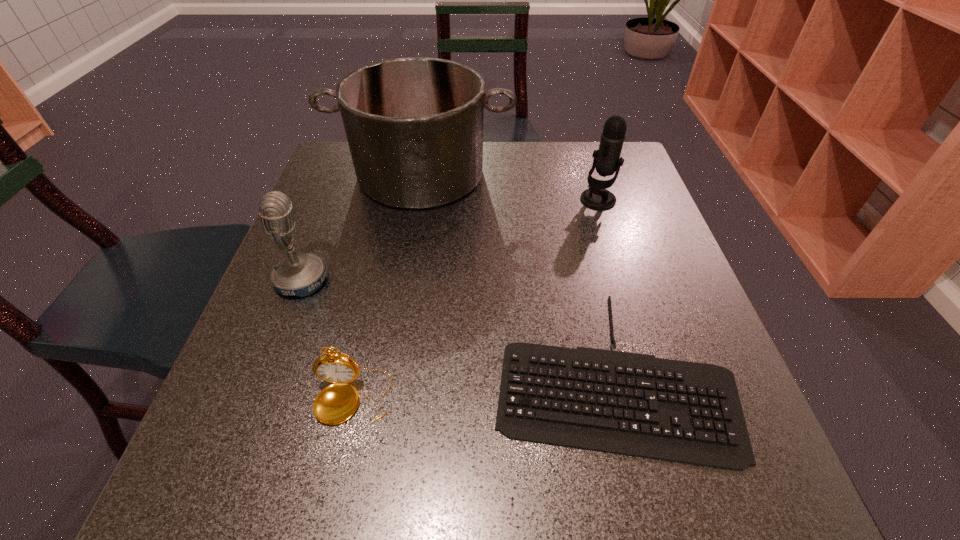
The height and width of the screenshot is (540, 960). I want to click on vacant area that satisfies the following two spatial constraints: 1. on the front side of the right microphone; 2. on the front-facing side of the left microphone, so click(x=623, y=280).

You are a GUI agent. You are given a task and a screenshot of the screen. Output one action in this format:
    pyautogui.click(x=<x>, y=<y>)
    Task: Click on the free space that satisfies the following two spatial constraints: 1. on the front side of the pan; 2. on the front-facing side of the nearer microphone
    Image resolution: width=960 pixels, height=540 pixels.
    Given the screenshot: What is the action you would take?
    pyautogui.click(x=403, y=280)